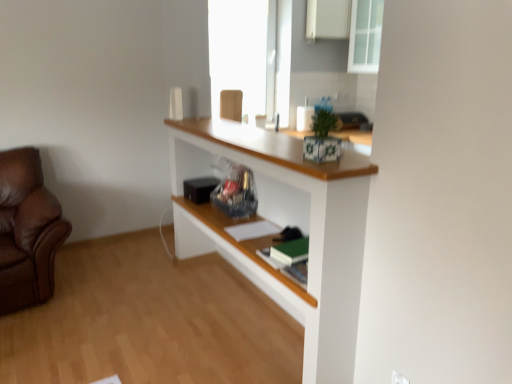
Locate an element on the screen. This screenshot has width=512, height=384. free spot above white matte book at center, the 1th book from the top (from a real-world perspective) is located at coordinates (256, 223).